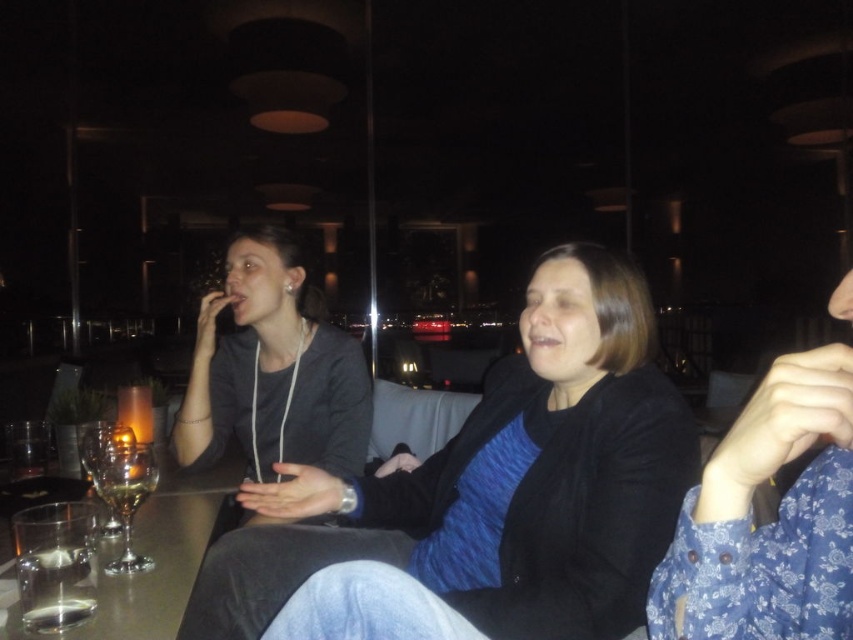
The image size is (853, 640). Describe the element at coordinates (56, 588) in the screenshot. I see `clear glass at lower left` at that location.

Between clear glass at lower left and clear glass wine glass at lower left, which one is positioned higher?

Positioned higher is clear glass wine glass at lower left.

At what (x,y) coordinates should I click in order to perform the action: click on clear glass at lower left. Please return your answer as a coordinate pair (x, y). Looking at the image, I should click on (56, 588).

Does point (509, 451) come farther from viewer compared to point (169, 580)?

Yes, it is behind point (169, 580).

Can you confirm if matte black jacket at center is positioned above clear glass table at center?

Correct, matte black jacket at center is located above clear glass table at center.

Does point (393, 528) lie behind point (16, 605)?

Yes, point (393, 528) is farther from viewer.

Where is `matte black jacket at center`? matte black jacket at center is located at coordinates (500, 483).

From the picture: Is metallic glass at lower left thinner than translucent glass wine at lower left?

Yes.

Which of these two, metallic glass at lower left or translucent glass wine at lower left, stands shorter?

With less height is metallic glass at lower left.

At what (x,y) coordinates should I click in order to perform the action: click on metallic glass at lower left. Please return your answer as a coordinate pair (x, y). The width and height of the screenshot is (853, 640). Looking at the image, I should click on (56, 614).